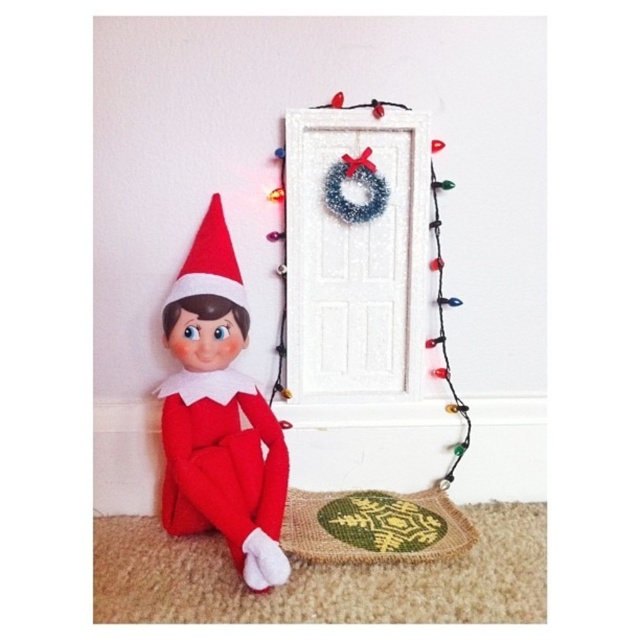
Question: Does multicolored string lights at upper center lie behind green woven mat at lower center?

Choices:
 (A) yes
 (B) no

Answer: (A)

Question: Which point is farther to the camera?

Choices:
 (A) (442, 497)
 (B) (278, 387)

Answer: (B)

Question: Is multicolored string lights at upper center positioned at the back of green woven mat at lower center?

Choices:
 (A) yes
 (B) no

Answer: (A)

Question: Is multicolored string lights at upper center closer to the viewer compared to green woven mat at lower center?

Choices:
 (A) yes
 (B) no

Answer: (B)